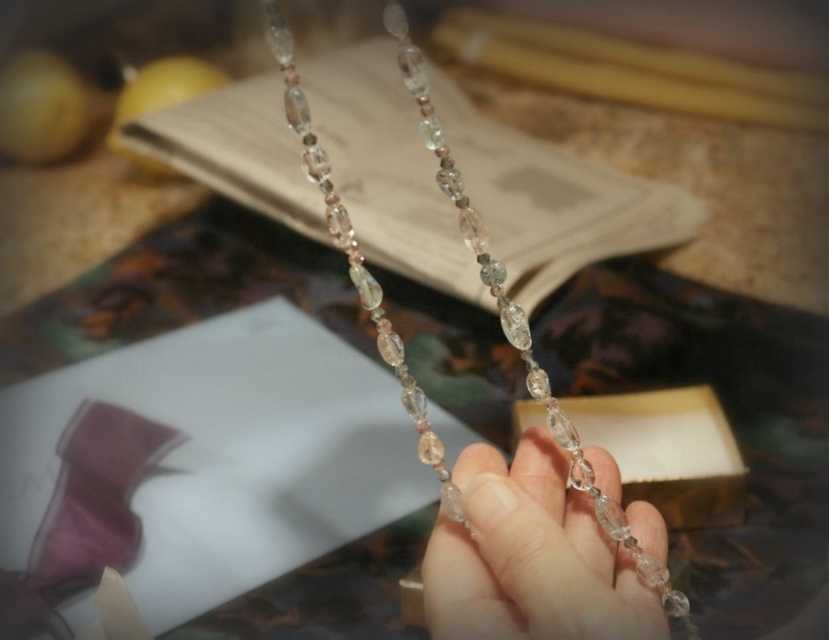
Is clear crystal beads at center positioned behind clear crystal necklace at center?

No, it is not.

Is clear crystal beads at center smaller than clear crystal necklace at center?

Yes.

Which is in front, point (634, 628) or point (401, 54)?

Point (634, 628) is more forward.

This screenshot has width=829, height=640. Find the location of `clear crystal beads at center`. clear crystal beads at center is located at coordinates (531, 556).